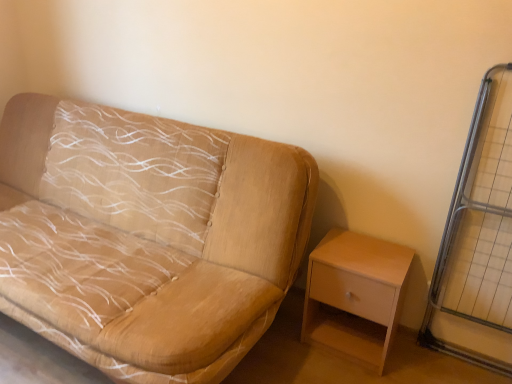
Locate an element on the screen. free space above light wood/wooden nightstand at lower right (from a real-world perspective) is located at coordinates (362, 253).